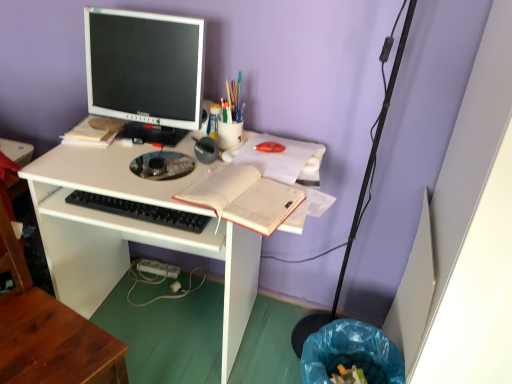
Where is `free point in front of white plastic power plugs and sockets at lower center`? The height and width of the screenshot is (384, 512). free point in front of white plastic power plugs and sockets at lower center is located at coordinates (174, 306).